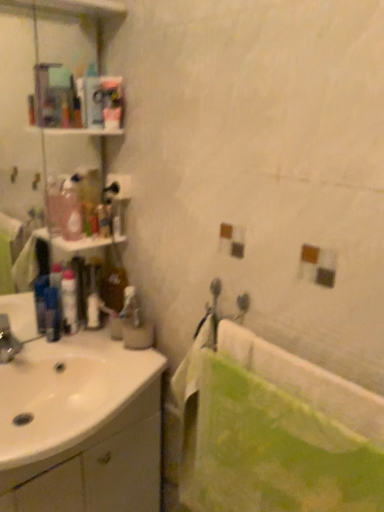
Question: Is blue plastic mouthwash at left taller than translucent plastic bottle at left?

Choices:
 (A) yes
 (B) no

Answer: (B)

Question: Can you confirm if blue plastic mouthwash at left is thinner than translucent plastic bottle at left?

Choices:
 (A) no
 (B) yes

Answer: (B)

Question: Does blue plastic mouthwash at left come behind translucent plastic bottle at left?

Choices:
 (A) yes
 (B) no

Answer: (A)

Question: Can you confirm if blue plastic mouthwash at left is smaller than translucent plastic bottle at left?

Choices:
 (A) yes
 (B) no

Answer: (A)

Question: Would you say blue plastic mouthwash at left is outside translucent plastic bottle at left?

Choices:
 (A) yes
 (B) no

Answer: (A)

Question: Is translucent plastic bottle at left spatially inside translucent plastic soap dispenser at left, the 2th toiletry when ordered from bottom to top, or outside of it?

Choices:
 (A) outside
 (B) inside

Answer: (A)

Question: Is point (74, 176) closer or farther from the camera than point (99, 205)?

Choices:
 (A) farther
 (B) closer

Answer: (A)

Question: In the image, is translucent plastic bottle at left positioned in front of or behind translucent plastic soap dispenser at left, which is counted as the 1th toiletry, starting from the top?

Choices:
 (A) behind
 (B) front

Answer: (B)

Question: Is translucent plastic bottle at left to the left or to the right of translucent plastic soap dispenser at left, which ranks as the second toiletry in left-to-right order, in the image?

Choices:
 (A) right
 (B) left

Answer: (B)

Question: Is green fabric towel at lower right wider or thinner than blue plastic mouthwash at left?

Choices:
 (A) thin
 (B) wide

Answer: (B)

Question: Considering the positions of green fabric towel at lower right and blue plastic mouthwash at left in the image, is green fabric towel at lower right bigger or smaller than blue plastic mouthwash at left?

Choices:
 (A) big
 (B) small

Answer: (A)

Question: In the image, is green fabric towel at lower right positioned in front of or behind blue plastic mouthwash at left?

Choices:
 (A) behind
 (B) front

Answer: (B)

Question: Would you say green fabric towel at lower right is inside or outside blue plastic mouthwash at left?

Choices:
 (A) inside
 (B) outside

Answer: (B)

Question: Is blue plastic mouthwash at left bigger or smaller than translucent plastic bottle at left?

Choices:
 (A) small
 (B) big

Answer: (A)

Question: In terms of height, does blue plastic mouthwash at left look taller or shorter compared to translucent plastic bottle at left?

Choices:
 (A) tall
 (B) short

Answer: (B)